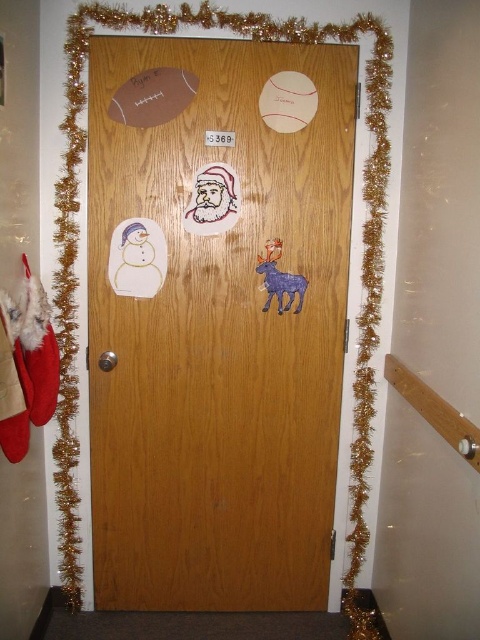
Question: From the image, what is the correct spatial relationship of wooden door at center in relation to matte paper santa at center?

Choices:
 (A) left
 (B) right

Answer: (B)

Question: Is wooden door at center closer to camera compared to matte paper santa at center?

Choices:
 (A) no
 (B) yes

Answer: (B)

Question: Which object is closer to the camera taking this photo?

Choices:
 (A) wooden door at center
 (B) matte paper santa at center

Answer: (A)

Question: Does wooden door at center appear under matte paper santa at center?

Choices:
 (A) yes
 (B) no

Answer: (A)

Question: Which point appears closest to the camera in this image?

Choices:
 (A) (132, 320)
 (B) (228, 228)

Answer: (B)